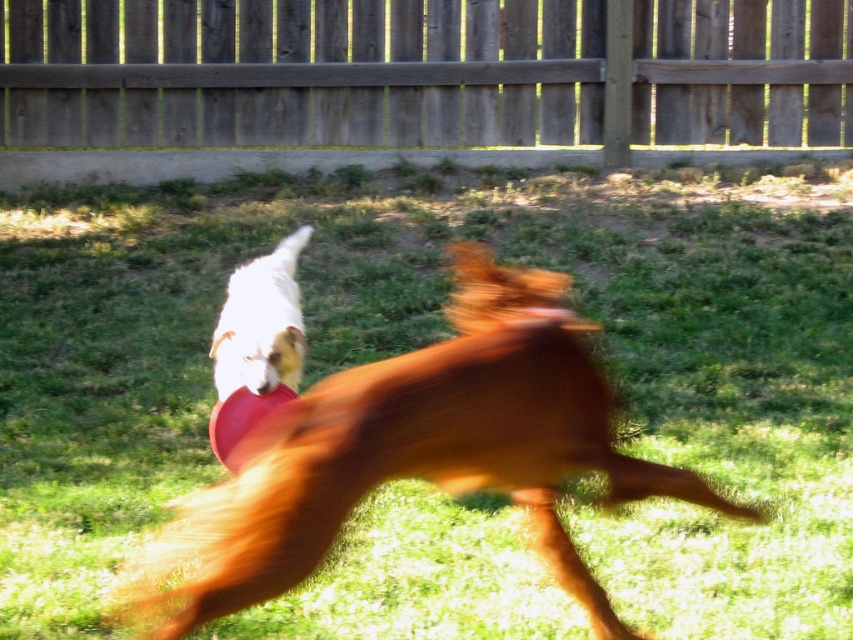
Question: Does wooden fence at upper center have a lesser width compared to smooth brown dog at center?

Choices:
 (A) yes
 (B) no

Answer: (B)

Question: Which of the following is the closest to the observer?

Choices:
 (A) white fur dog at upper left
 (B) smooth brown dog at center

Answer: (B)

Question: Among these points, which one is farthest from the camera?

Choices:
 (A) (738, 93)
 (B) (306, 422)

Answer: (A)

Question: Can you confirm if smooth brown dog at center is positioned above white fur dog at upper left?

Choices:
 (A) yes
 (B) no

Answer: (B)

Question: Which object appears closest to the camera in this image?

Choices:
 (A) wooden fence at upper center
 (B) white fur dog at upper left
 (C) smooth brown dog at center

Answer: (C)

Question: Can you confirm if smooth brown dog at center is positioned below white fur dog at upper left?

Choices:
 (A) yes
 (B) no

Answer: (A)